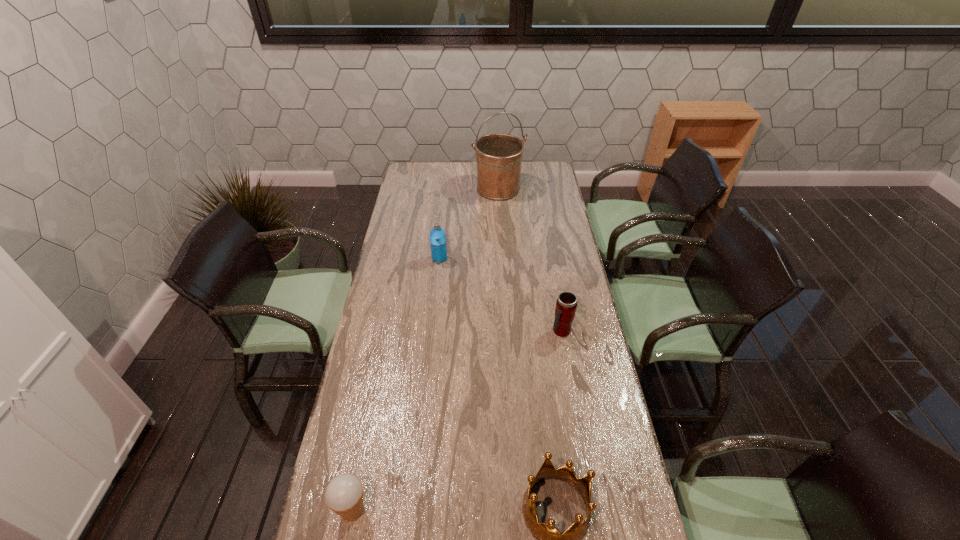
Where is `blank region between the left thermos bottle and the leftmost object`? This screenshot has height=540, width=960. blank region between the left thermos bottle and the leftmost object is located at coordinates (396, 384).

Where is `unoccupied position between the right thermos bottle and the second farthest object`? The image size is (960, 540). unoccupied position between the right thermos bottle and the second farthest object is located at coordinates (500, 295).

Where is `empty space that is in between the nearer thermos bottle and the leftmost object`? Image resolution: width=960 pixels, height=540 pixels. empty space that is in between the nearer thermos bottle and the leftmost object is located at coordinates (457, 421).

Find the location of a particular element. free point between the icecream and the right thermos bottle is located at coordinates (457, 421).

Where is `vacant space that is in between the right thermos bottle and the farthest object`? vacant space that is in between the right thermos bottle and the farthest object is located at coordinates (530, 260).

Select which object appears as the third closest to the third farthest object. Please provide its 2D coordinates. Your answer should be formatted as a tuple, i.e. [(x, y)], where the tuple contains the x and y coordinates of a point satisfying the conditions above.

[(344, 494)]

The height and width of the screenshot is (540, 960). Identify the location of object that stands as the second closest to the crown. (566, 304).